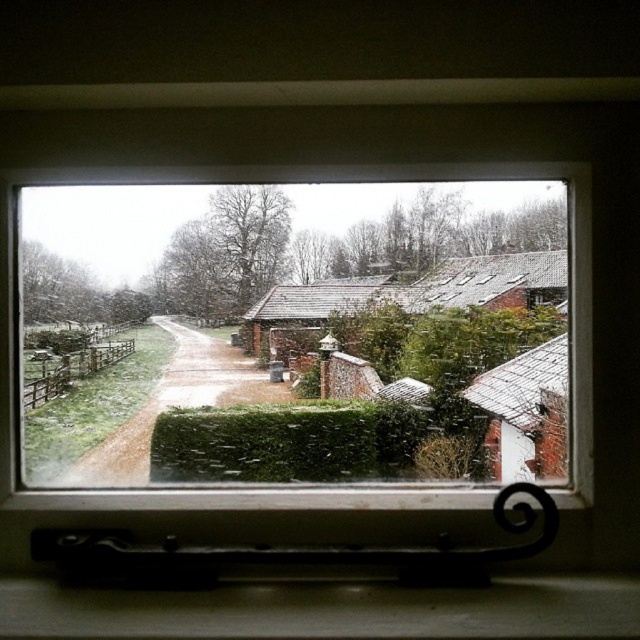
Question: Where is clear glass window at center located in relation to matte white sill at lower center in the image?

Choices:
 (A) below
 (B) above

Answer: (B)

Question: Which point is closer to the camera?

Choices:
 (A) (52, 614)
 (B) (289, 218)

Answer: (A)

Question: Is clear glass window at center bigger than matte white sill at lower center?

Choices:
 (A) yes
 (B) no

Answer: (A)

Question: Is clear glass window at center closer to camera compared to matte white sill at lower center?

Choices:
 (A) yes
 (B) no

Answer: (B)

Question: Which of the following is the closest to the observer?

Choices:
 (A) (145, 433)
 (B) (45, 620)

Answer: (B)